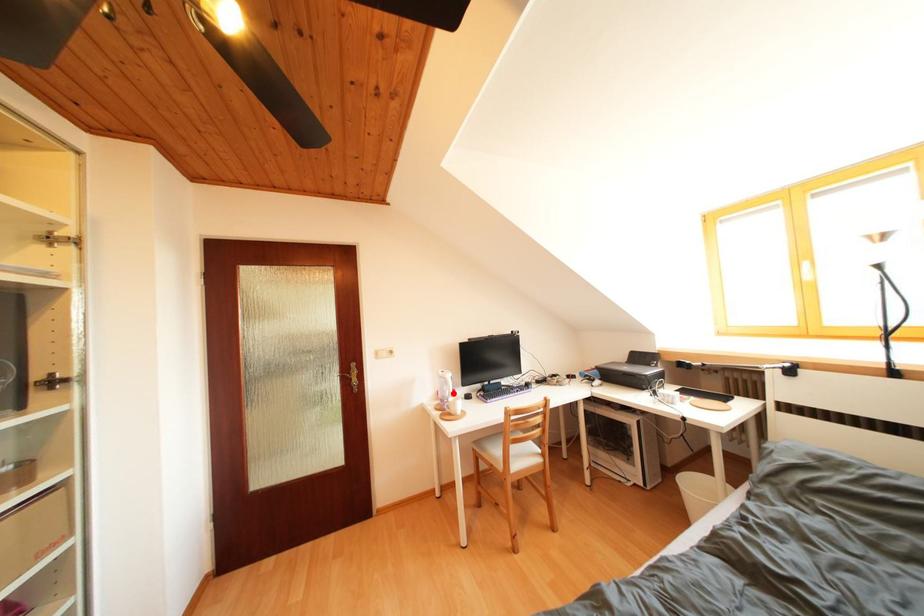
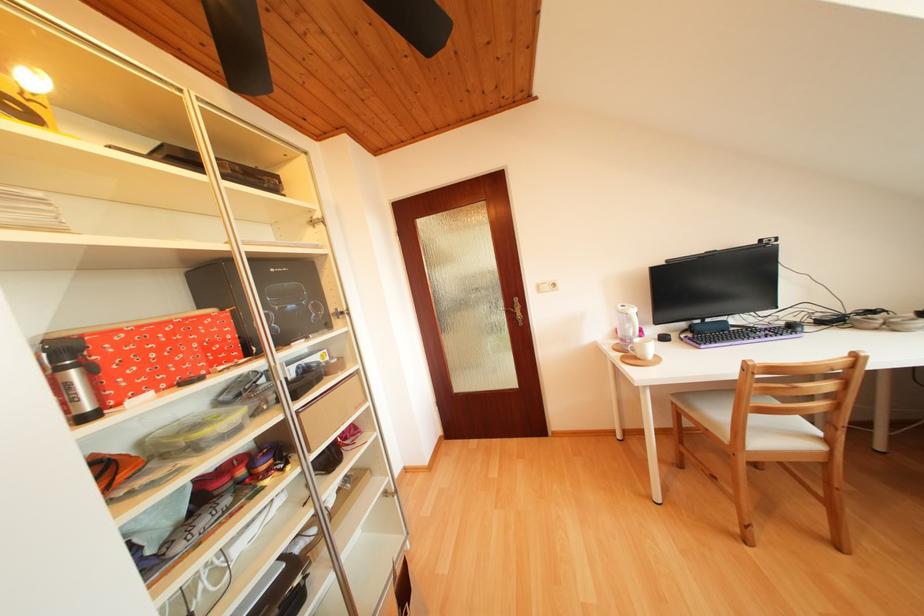
Question: I am providing you with two images of the same scene from different viewpoints. A red point is marked on the first image. Can you still see the location of the red point in image 2?

Choices:
 (A) Yes
 (B) No

Answer: (A)